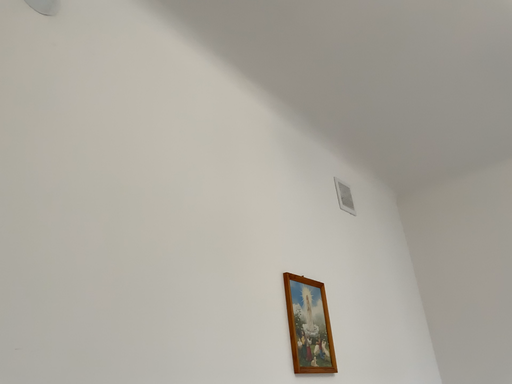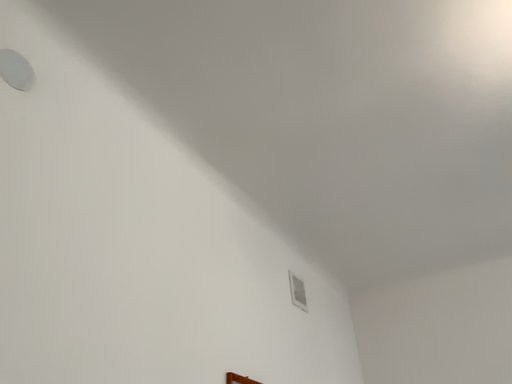
Question: How did the camera likely rotate when shooting the video?

Choices:
 (A) rotated downward
 (B) rotated upward

Answer: (B)